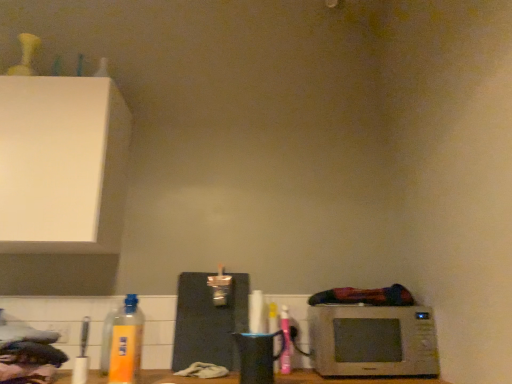
Locate an element on the screen. This screenshot has height=384, width=512. vacant point above black matte cutting board at center (from a real-world perspective) is located at coordinates (217, 264).